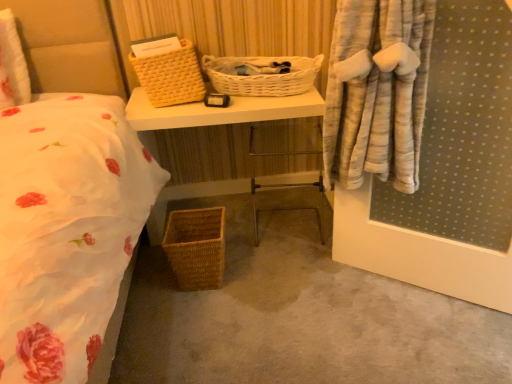
Locate an element on the screen. Image resolution: width=512 pixels, height=384 pixels. free space in front of matte wicker basket at center is located at coordinates coord(248,298).